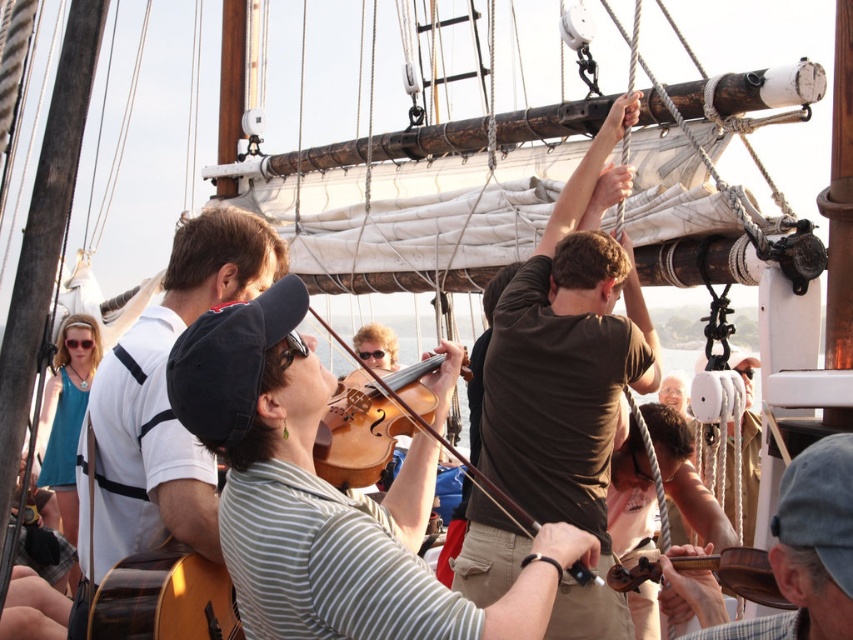
You are a photographer on the ship trying to capture both the light brown wooden violin at center and the wooden violin at lower right in a single shot. Which violin should you position closer to the left side of your camera frame to ensure both are visible?

You should position the light brown wooden violin at center closer to the left side of your camera frame because it is already to the left of the wooden violin at lower right, so aligning it this way will include both violins in the shot.

You are standing on the deck of the ship and see two points marked on the image. Which point is closer to you, point (x=332, y=451) or point (x=740, y=563)?

Point (x=332, y=451) is closer to you because it is further to the camera than point (x=740, y=563).

You are a musician on the ship and need to choose an instrument to play. Which instrument has a wider body between the wooden guitar at left and the light brown wooden violin at center?

The wooden guitar at left has a wider body than the light brown wooden violin at center.